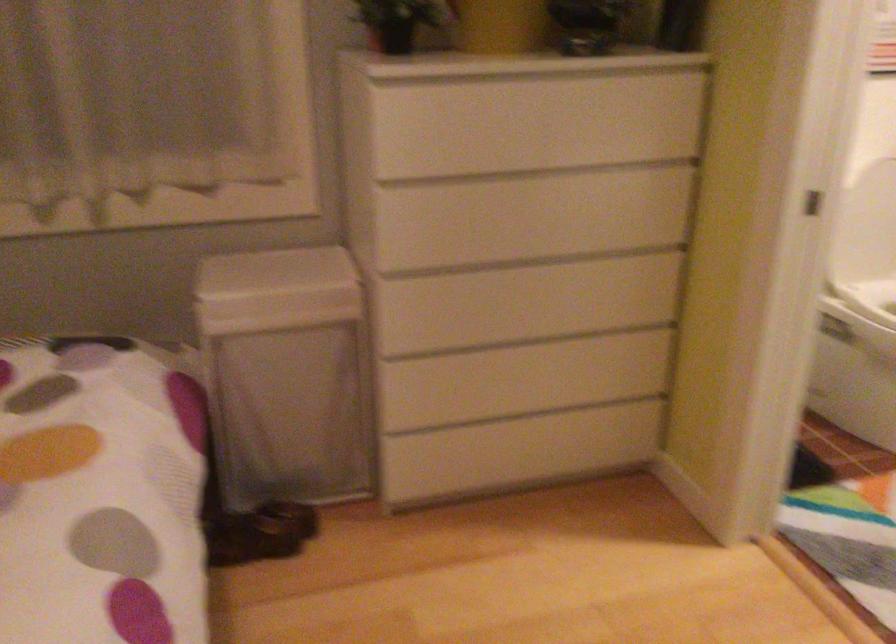
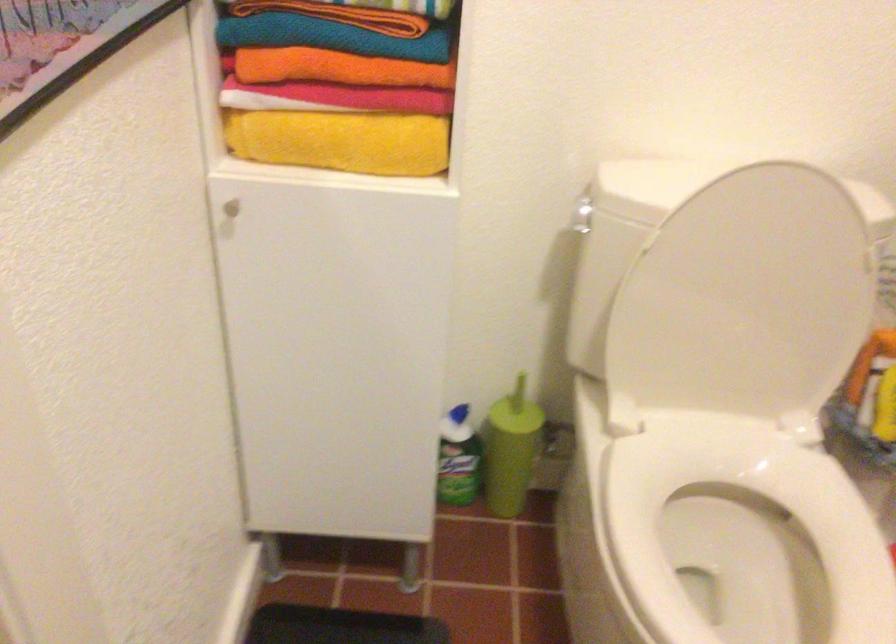
In the second image, find the point that corresponds to point (684, 216) in the first image.

(228, 210)